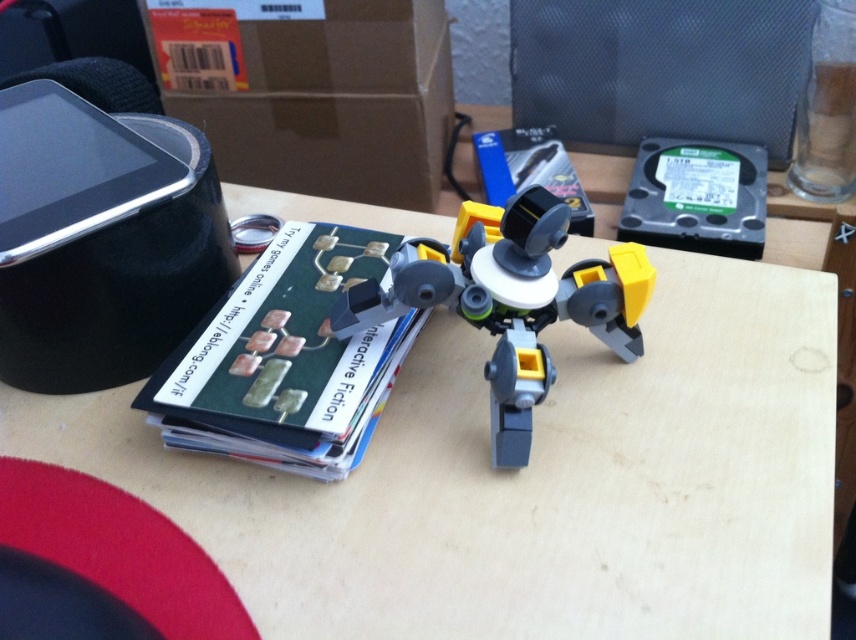
Can you confirm if matte plastic book at center is smaller than gray plastic robot at center?

Incorrect, matte plastic book at center is not smaller in size than gray plastic robot at center.

Is matte plastic book at center in front of gray plastic robot at center?

No.

Who is more distant from viewer, (x=302, y=227) or (x=355, y=301)?

The point (x=302, y=227) is more distant.

You are a GUI agent. You are given a task and a screenshot of the screen. Output one action in this format:
    pyautogui.click(x=<x>, y=<y>)
    Task: Click on the matte plastic book at center
    The width and height of the screenshot is (856, 640).
    Given the screenshot: What is the action you would take?
    pyautogui.click(x=284, y=358)